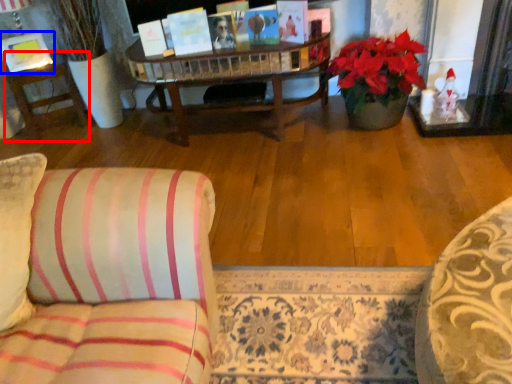
Question: Which object appears farthest to the camera in this image, side table (highlighted by a red box) or picture frame (highlighted by a blue box)?

Choices:
 (A) side table
 (B) picture frame

Answer: (A)